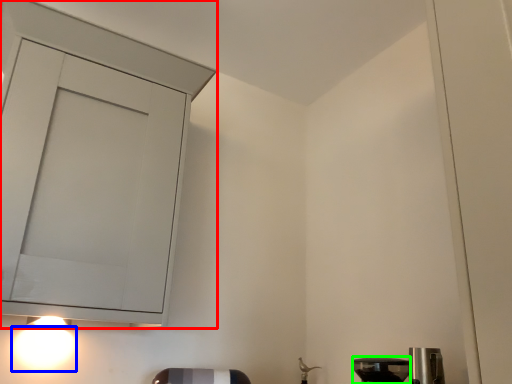
Question: Which is nearer to the cabinetry (highlighted by a red box)? light (highlighted by a blue box) or appliance (highlighted by a green box).

Choices:
 (A) light
 (B) appliance

Answer: (A)